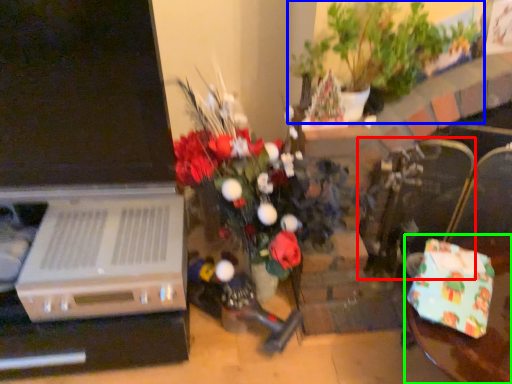
Question: Which object is positioned farthest from armchair (highlighted by a red box)? Select from houseplant (highlighted by a blue box) and table (highlighted by a green box).

Choices:
 (A) houseplant
 (B) table

Answer: (A)